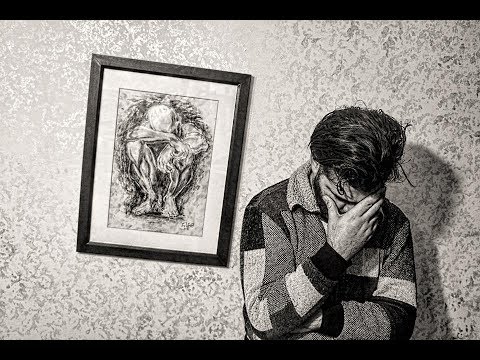
You are a GUI agent. You are given a task and a screenshot of the screen. Output one action in this format:
    pyautogui.click(x=<x>, y=<y>)
    Task: Click on the wreath-like object
    Image resolution: width=480 pixels, height=360 pixels.
    Given the screenshot: What is the action you would take?
    pyautogui.click(x=126, y=128)